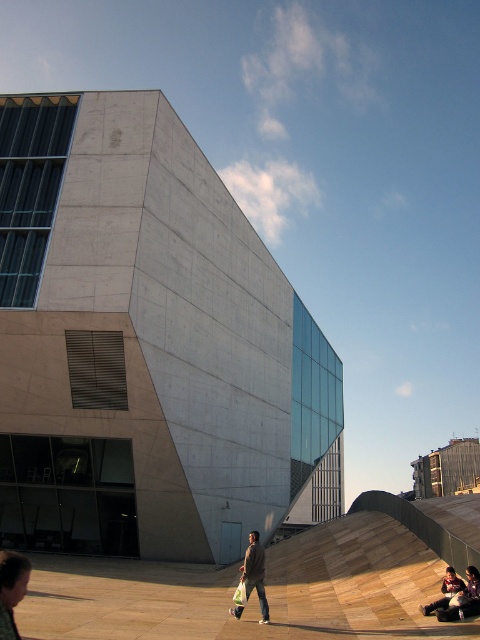
You are a fashion designer observing an urban scene with a light brown leather jacket at lower left and a denim jacket at center. Which jacket has a shorter length?

The light brown leather jacket at lower left is shorter than the denim jacket at center.